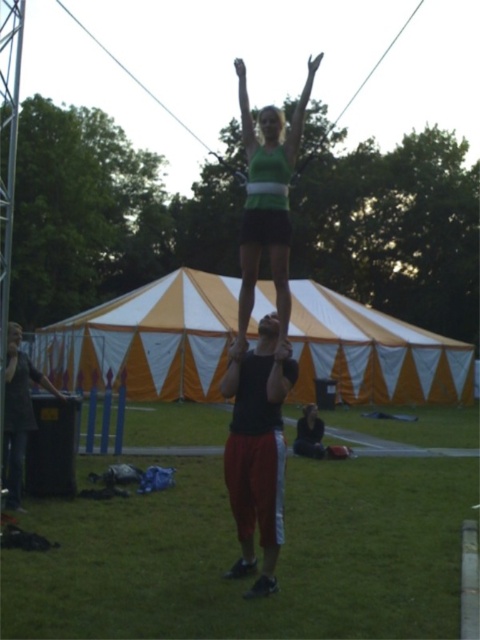
You are a photographer positioned to the side of the performance. You need to capture a photo where the green matte tank top at center is clearly visible above the matte black head at center. Based on the current setup, will this be possible?

Yes, because the green matte tank top at center is already positioned above the matte black head at center, so the photographer can capture the desired composition.

You are standing at the center of the grassy field where the acrobatic performance is happening. You notice two points marked in the scene. The first point is at coordinates point (279, 284) and the second is at point (19, 442). If you were to walk directly towards the first point, would you pass by the second point before reaching the first one?

Yes, because point (279, 284) is in front of point (19, 442), so walking towards the first point would require passing the second point first.